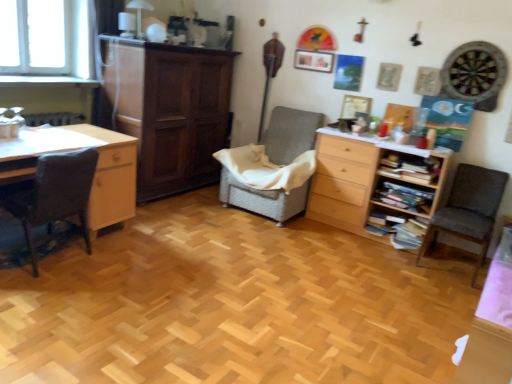
At what (x,y) coordinates should I click in order to perform the action: click on free space between dark gray fabric chair at right, the first chair from the right, and dark gray fabric chair at left, the third chair from the right. Please return your answer as a coordinate pair (x, y). Image resolution: width=512 pixels, height=384 pixels. Looking at the image, I should click on (259, 260).